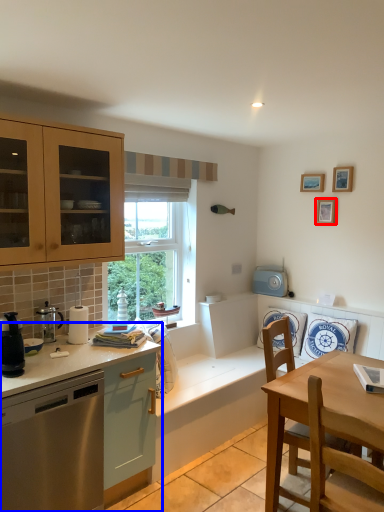
Question: Which point is closer to the camera, picture frame (highlighted by a red box) or countertop (highlighted by a blue box)?

Choices:
 (A) picture frame
 (B) countertop

Answer: (B)